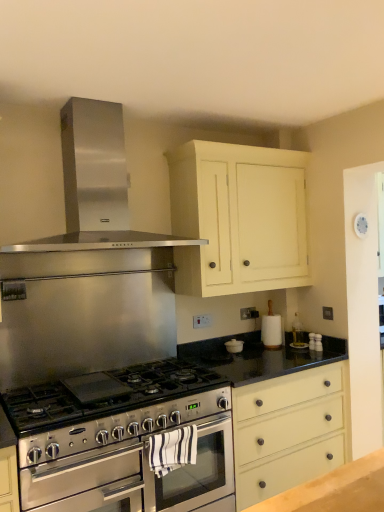
Question: From a real-world perspective, is matte cream drawer at center physically located above or below stainless steel oven at center, the 1th oven in the back-to-front sequence?

Choices:
 (A) above
 (B) below

Answer: (B)

Question: Choose the correct answer: Is matte cream drawer at center inside stainless steel oven at center, the 1th oven in the back-to-front sequence, or outside it?

Choices:
 (A) inside
 (B) outside

Answer: (B)

Question: Estimate the real-world distances between objects in this image. Which object is closer to the stainless steel oven at center, the 1th oven in the back-to-front sequence?

Choices:
 (A) stainless steel gas stove at center
 (B) stainless steel oven at center, which appears as the second oven when viewed from the back
 (C) white painted wood cabinet at upper center
 (D) matte cream drawer at center
 (E) stainless steel exhaust hood at upper center

Answer: (B)

Question: Based on their relative distances, which object is nearer to the stainless steel gas stove at center?

Choices:
 (A) stainless steel oven at center, which appears as the second oven when viewed from the back
 (B) matte cream drawer at center
 (C) stainless steel exhaust hood at upper center
 (D) white painted wood cabinet at upper center
 (E) stainless steel oven at center, the 1th oven in the back-to-front sequence

Answer: (A)